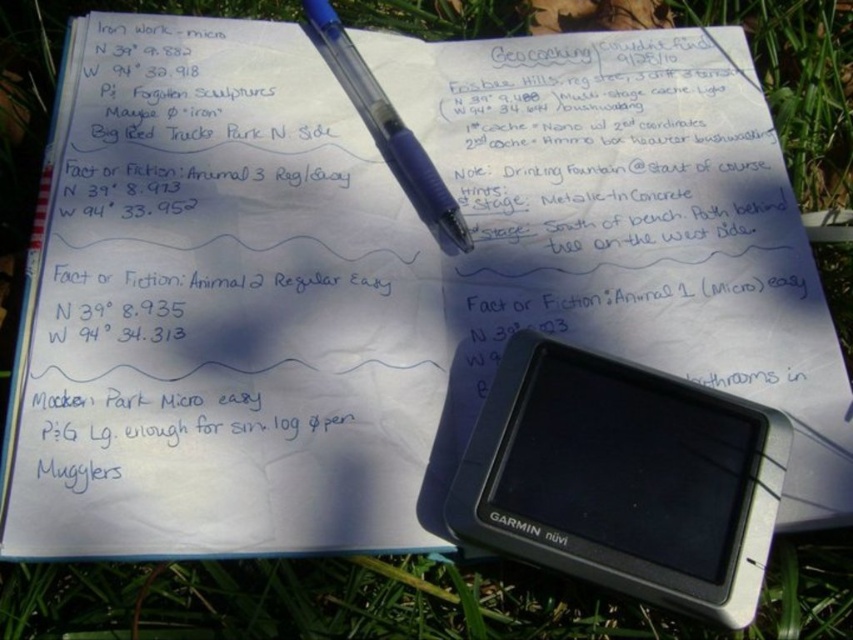
You are a geocacher preparing to navigate using the Garmin n?vi GPS device. You notice the black plastic GPS at center and the blue plastic pen at upper center. How far apart are these two items in inches?

The black plastic GPS at center is 13.06 inches from the blue plastic pen at upper center.

You are a geocacher who just found the notebook with coordinates. You need to use the GPS device to navigate. However, the GPS is off. Can you determine if the blue plastic pen at upper center can be used to turn on the black plastic gps at center?

The black plastic gps at center is larger than the blue plastic pen at upper center, so the pen is smaller and might not be suitable to press the power button of the GPS. However, the size difference alone doesn not confirm if the pen can activate the button. You should try using the pen cautiously.